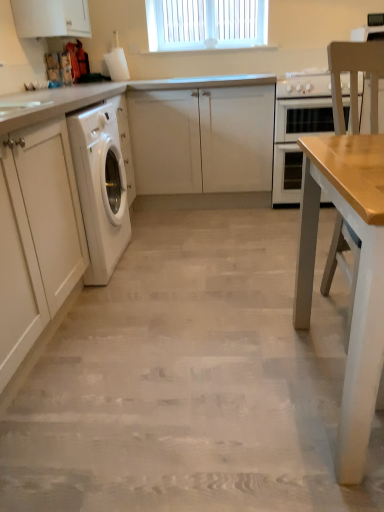
Question: Does white plastic window at upper center lie behind light wood chair at right?

Choices:
 (A) yes
 (B) no

Answer: (A)

Question: Does white plastic window at upper center appear on the left side of light wood chair at right?

Choices:
 (A) no
 (B) yes

Answer: (B)

Question: From the image's perspective, is white plastic window at upper center below light wood chair at right?

Choices:
 (A) yes
 (B) no

Answer: (B)

Question: From a real-world perspective, is white plastic window at upper center located beneath light wood chair at right?

Choices:
 (A) yes
 (B) no

Answer: (B)

Question: Would you say white plastic window at upper center is outside light wood chair at right?

Choices:
 (A) no
 (B) yes

Answer: (B)

Question: Would you say white plastic window at upper center contains light wood chair at right?

Choices:
 (A) yes
 (B) no

Answer: (B)

Question: From a real-world perspective, is white glossy stove at upper right below white matte cabinet at center, the 3th cabinetry in the front-to-back sequence?

Choices:
 (A) no
 (B) yes

Answer: (A)

Question: From the image's perspective, would you say white glossy stove at upper right is positioned over white matte cabinet at center, positioned as the second cabinetry in top-to-bottom order?

Choices:
 (A) yes
 (B) no

Answer: (A)

Question: Is white matte cabinet at center, placed as the 2th cabinetry when sorted from bottom to top, completely or partially inside white glossy stove at upper right?

Choices:
 (A) no
 (B) yes

Answer: (A)

Question: From the image's perspective, is white glossy stove at upper right below white matte cabinet at center, positioned as the second cabinetry in top-to-bottom order?

Choices:
 (A) no
 (B) yes

Answer: (A)

Question: Considering the relative positions of white glossy stove at upper right and white matte cabinet at center, the 3th cabinetry in the front-to-back sequence, in the image provided, is white glossy stove at upper right to the left of white matte cabinet at center, the 3th cabinetry in the front-to-back sequence, from the viewer's perspective?

Choices:
 (A) yes
 (B) no

Answer: (B)

Question: Does white glossy stove at upper right have a greater height compared to white matte cabinet at center, positioned as the second cabinetry in top-to-bottom order?

Choices:
 (A) no
 (B) yes

Answer: (A)

Question: Considering the relative sizes of white matte cabinet at center, the 1th cabinetry positioned from the back, and light beige wood floor at center in the image provided, is white matte cabinet at center, the 1th cabinetry positioned from the back, wider than light beige wood floor at center?

Choices:
 (A) no
 (B) yes

Answer: (A)